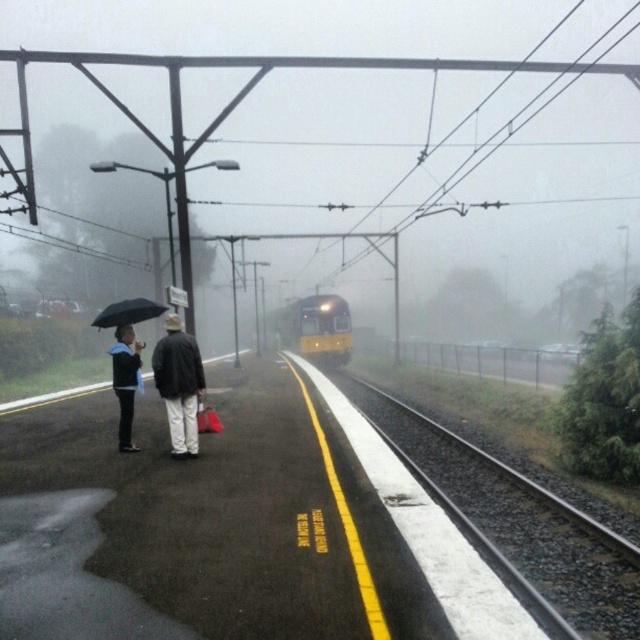
You are a passenger on the platform and need to board the yellow metallic train at center. There is a person wearing a dark gray fabric jacket at center blocking your path. Can you walk around them to reach the train?

The dark gray fabric jacket at center is in front of the yellow metallic train at center, so you can walk around them to reach the train since they are blocking the path directly in front.

You are a passenger on the platform and need to board the train. The train doors are located along the smooth steel train track at center. Considering the visibility due to the fog, will the dark gray fabric jacket at center block your view of the train doors when standing near the track?

The smooth steel train track at center is not as tall as the dark gray fabric jacket at center, so if the jacket is positioned between you and the track, it could potentially block your view of the train doors, especially in low visibility conditions caused by the fog.